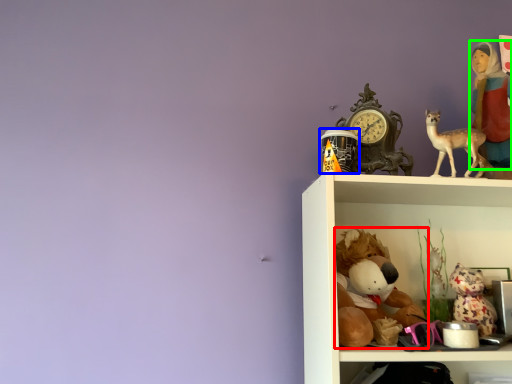
Question: Which object is positioned closest to toy (highlighted by a red box)? Select from toy (highlighted by a blue box) and person (highlighted by a green box).

Choices:
 (A) toy
 (B) person

Answer: (A)